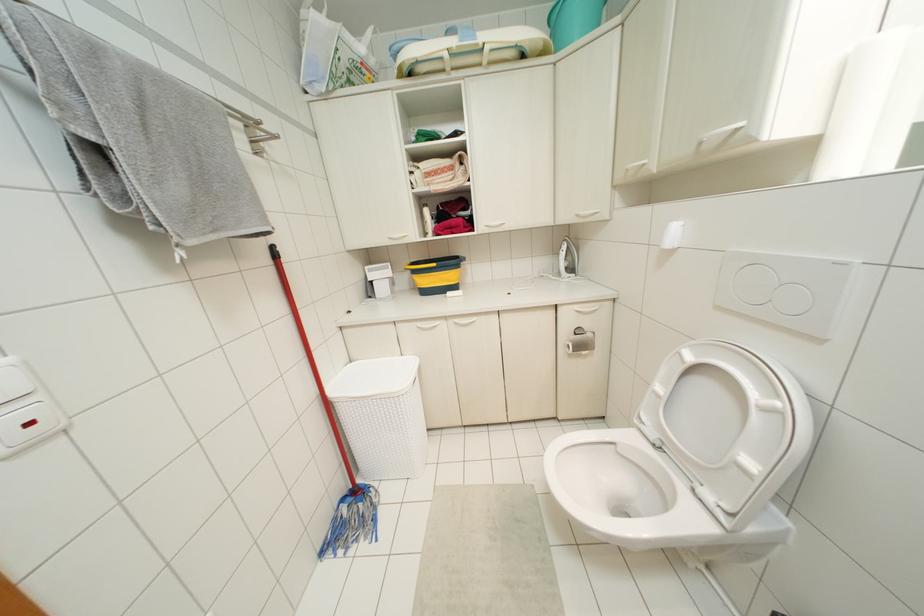
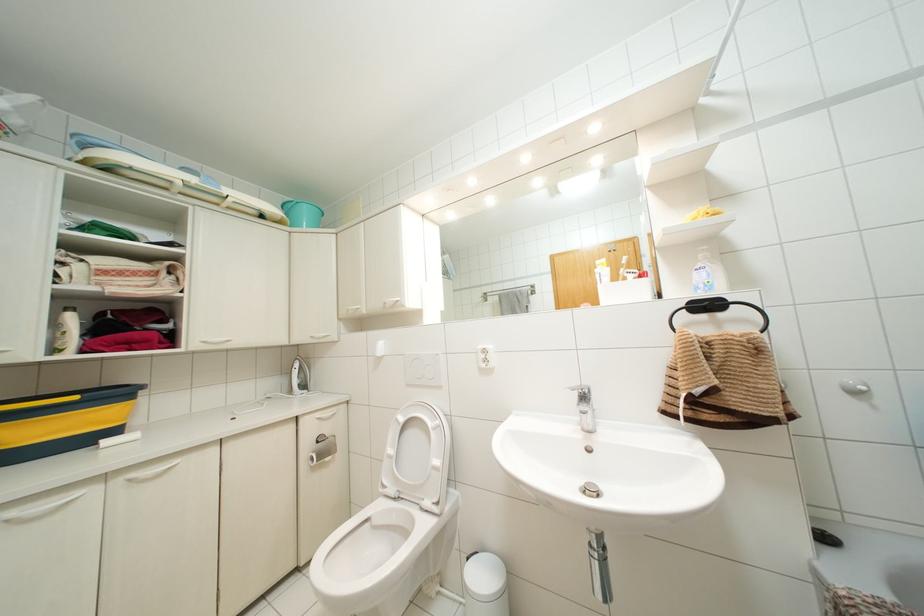
Where in the second image is the point corresponding to pixel 456 320 from the first image?

(132, 475)